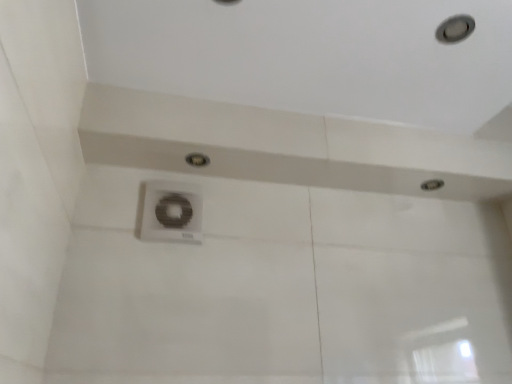
Question: Is white plastic vent at center inside or outside of matte silver droplight at center, the 1th droplight from the top?

Choices:
 (A) inside
 (B) outside

Answer: (B)

Question: From the image's perspective, is white plastic vent at center positioned above or below matte silver droplight at center, the first droplight when ordered from front to back?

Choices:
 (A) above
 (B) below

Answer: (B)

Question: Which object is the closest to the matte silver droplight at upper right, which appears as the 2th droplight when viewed from the left?

Choices:
 (A) white plastic vent at center
 (B) matte silver droplight at center, the first droplight when ordered from front to back

Answer: (B)

Question: Estimate the real-world distances between objects in this image. Which object is closer to the white plastic vent at center?

Choices:
 (A) matte silver droplight at upper right, which is the 2th droplight from front to back
 (B) matte silver droplight at center, marked as the 1th droplight in a left-to-right arrangement

Answer: (B)